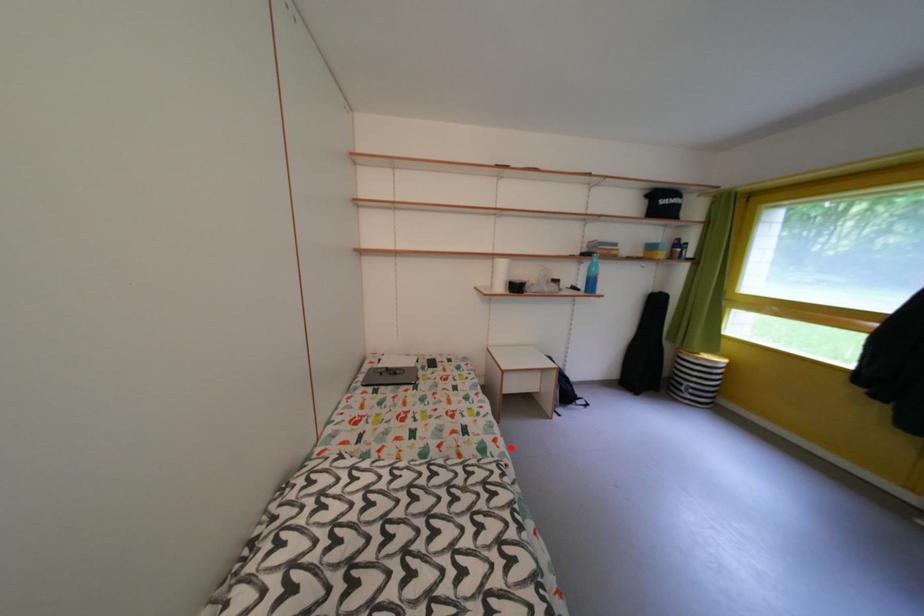
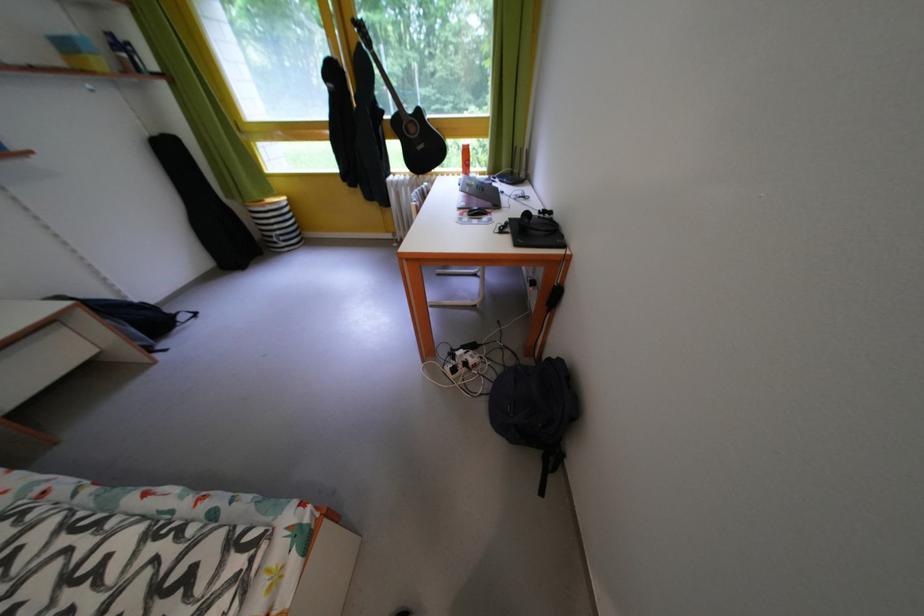
Where in the second image is the point corresponding to the highlighted location from the first image?

(23, 485)